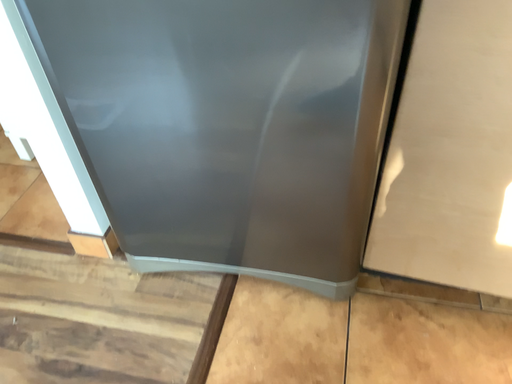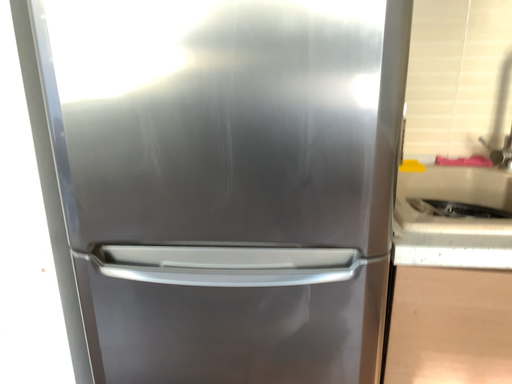
Question: How did the camera likely rotate when shooting the video?

Choices:
 (A) rotated left
 (B) rotated right

Answer: (B)